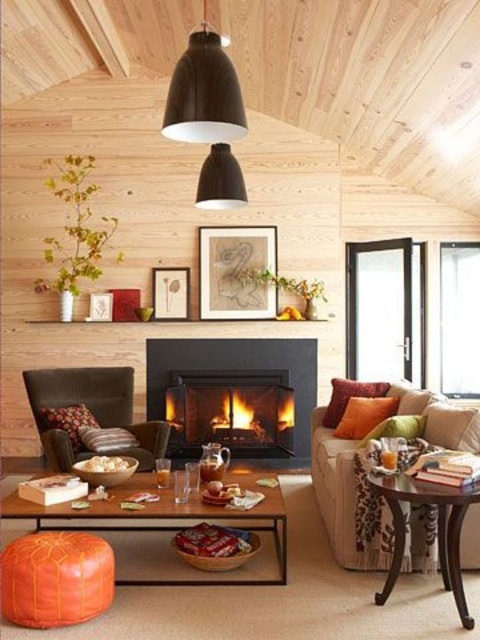
Between velvet beige couch at center and green velvet pillow at right, which one has more height?

velvet beige couch at center is taller.

What do you see at coordinates (348, 500) in the screenshot?
I see `velvet beige couch at center` at bounding box center [348, 500].

In order to click on velvet beige couch at center in this screenshot , I will do `click(348, 500)`.

Does matte brown picture frame at center have a greater height compared to green velvet pillow at right?

Correct, matte brown picture frame at center is much taller as green velvet pillow at right.

Is matte brown picture frame at center thinner than green velvet pillow at right?

In fact, matte brown picture frame at center might be wider than green velvet pillow at right.

Is point (210, 282) more distant than point (397, 429)?

Yes, point (210, 282) is behind point (397, 429).

I want to click on matte brown picture frame at center, so click(x=236, y=273).

Who is positioned more to the left, black matte fireplace at center or floral fabric pillow at center?

floral fabric pillow at center

Describe the element at coordinates (233, 392) in the screenshot. The image size is (480, 640). I see `black matte fireplace at center` at that location.

Is point (166, 406) positioned behind point (82, 417)?

That is True.

I want to click on black matte fireplace at center, so click(x=233, y=392).